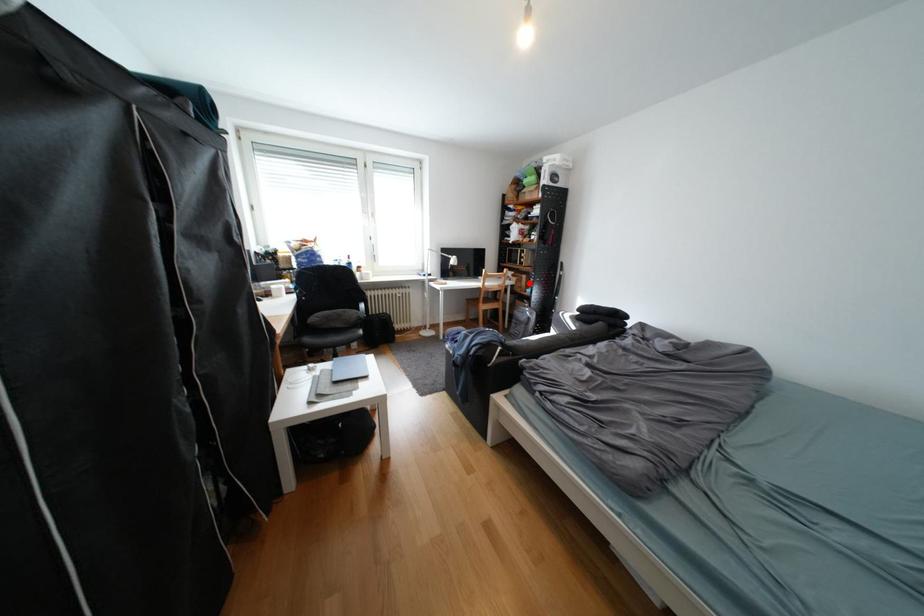
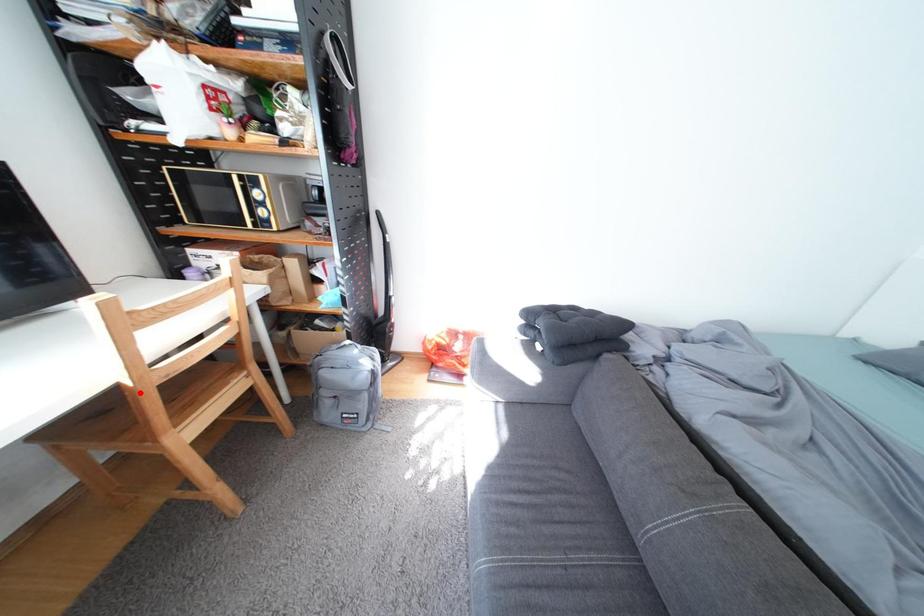
I am providing you with two images of the same scene from different viewpoints. A red point is marked on the first image and another point is marked on the second image. Do the highlighted points in image1 and image2 indicate the same real-world spot?

No